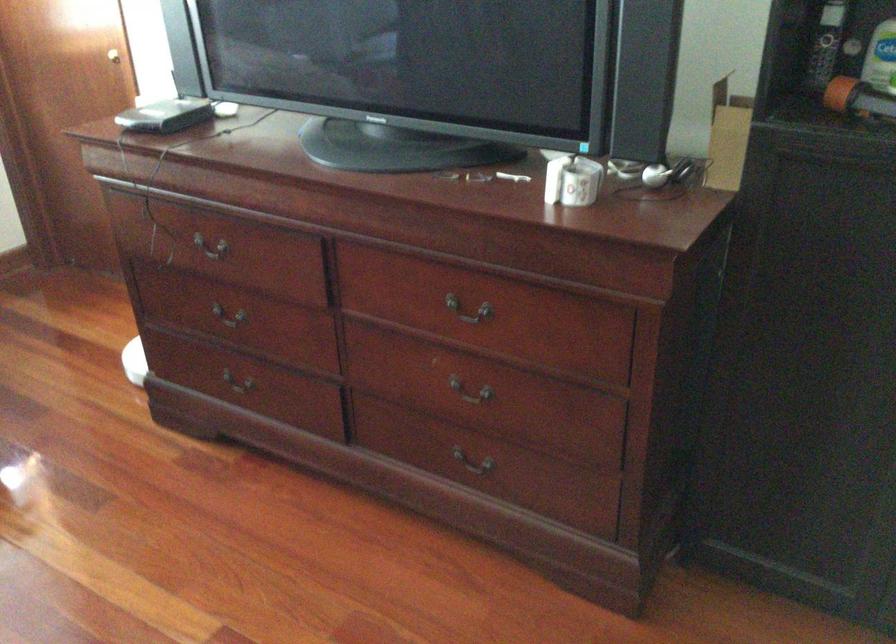
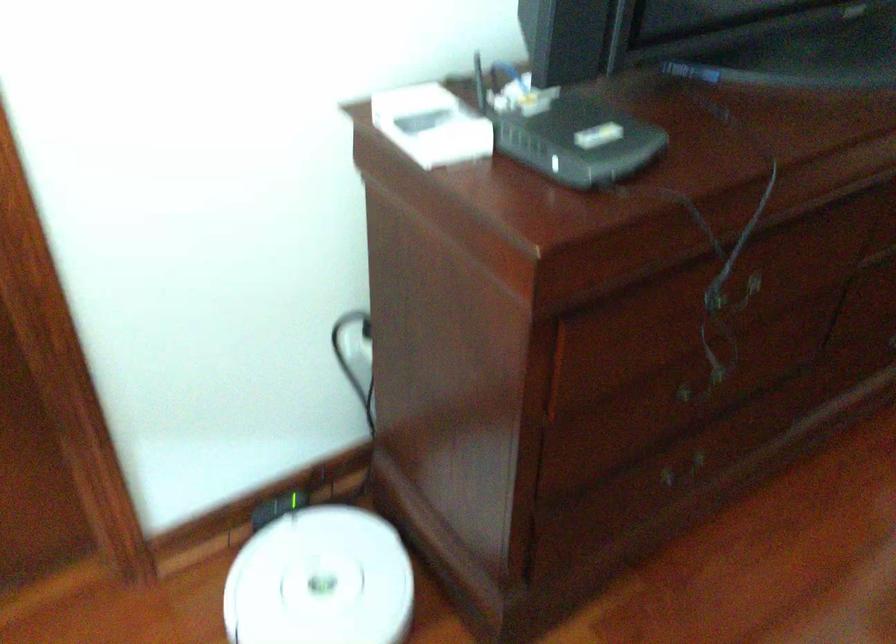
Locate, in the second image, the point that corresponds to point 246,409 in the first image.

(684, 473)